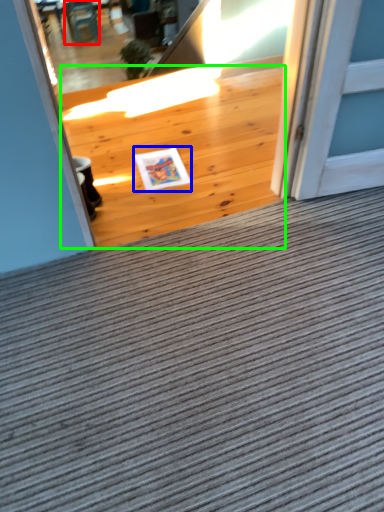
Question: Estimate the real-world distances between objects in this image. Which object is closer to chair (highlighted by a red box), postcard (highlighted by a blue box) or hardwood (highlighted by a green box)?

Choices:
 (A) postcard
 (B) hardwood

Answer: (B)